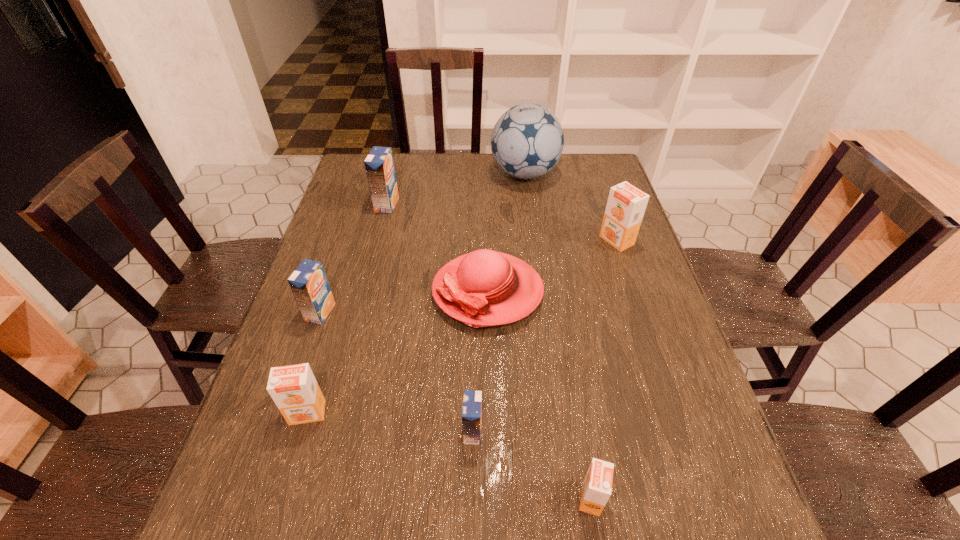
In the image, there is a desktop. At what (x,y) coordinates should I click in order to perform the action: click on vacant space at the far edge. Please return your answer as a coordinate pair (x, y). Looking at the image, I should click on (407, 157).

The height and width of the screenshot is (540, 960). In the image, there is a desktop. What are the coordinates of `blank space at the near edge` in the screenshot? It's located at pos(354,529).

This screenshot has height=540, width=960. I want to click on vacant position at the left edge of the desktop, so [x=294, y=493].

I want to click on vacant space at the right edge, so (655, 511).

The width and height of the screenshot is (960, 540). Identify the location of vacant region at the far right corner of the desktop. (603, 186).

At what (x,y) coordinates should I click in order to perform the action: click on blank region between the second smallest blue orange_juice and the second smallest orange orange juice. Please return your answer as a coordinate pair (x, y). Looking at the image, I should click on (314, 362).

The width and height of the screenshot is (960, 540). What are the coordinates of `unoccupied area between the red hat and the seventh nearest object` in the screenshot? It's located at (437, 248).

Where is `empty location between the leftmost blue orange_juice and the tallest object`? The image size is (960, 540). empty location between the leftmost blue orange_juice and the tallest object is located at coordinates (422, 243).

I want to click on free space between the leftmost blue orange_juice and the farthest orange juice, so click(x=353, y=259).

At what (x,y) coordinates should I click in order to perform the action: click on empty location between the leftmost orange orange juice and the biggest blue orange_juice. Please return your answer as a coordinate pair (x, y). The width and height of the screenshot is (960, 540). Looking at the image, I should click on (348, 309).